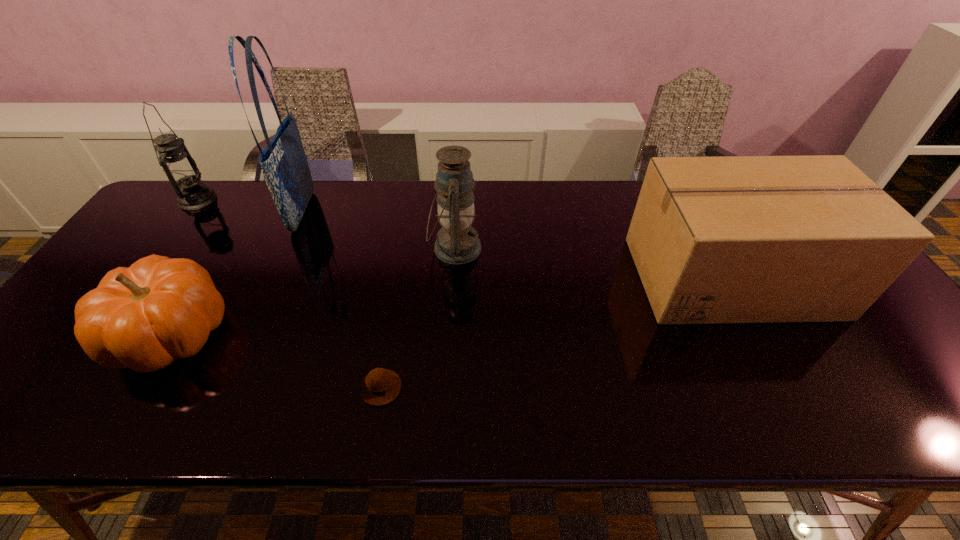
Identify the location of object positioned at the far left corner. This screenshot has height=540, width=960. click(181, 170).

I want to click on vacant space at the far edge of the desktop, so click(x=343, y=195).

Identify the location of free location at the near edge. (527, 409).

Identify the location of vacant area at the right edge. (856, 332).

The width and height of the screenshot is (960, 540). I want to click on vacant area that lies between the tallest object and the left oil lamp, so click(251, 206).

Where is `vacant space that's between the second shortest object and the rightmost object`? vacant space that's between the second shortest object and the rightmost object is located at coordinates pos(451,306).

Where is `free point between the fifth object from left to right and the fourth object from right to left`? The width and height of the screenshot is (960, 540). free point between the fifth object from left to right and the fourth object from right to left is located at coordinates (379, 230).

You are a GUI agent. You are given a task and a screenshot of the screen. Output one action in this format:
    pyautogui.click(x=<x>, y=<y>)
    Task: Click on the vacant space that is in between the shortest object and the second shortest object
    
    Given the screenshot: What is the action you would take?
    pyautogui.click(x=276, y=361)

Identify the location of free space between the pumpkin and the rightmost object. point(451,306).

Where is `free area in between the third object from right to left and the left oil lamp`? The image size is (960, 540). free area in between the third object from right to left and the left oil lamp is located at coordinates (289, 294).